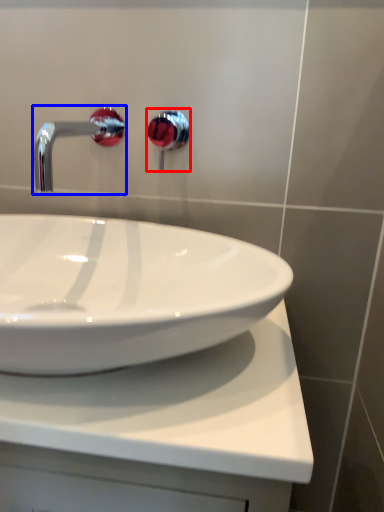
Question: Which of the following is the farthest to the observer, plumbing fixture (highlighted by a red box) or tap (highlighted by a blue box)?

Choices:
 (A) plumbing fixture
 (B) tap

Answer: (A)